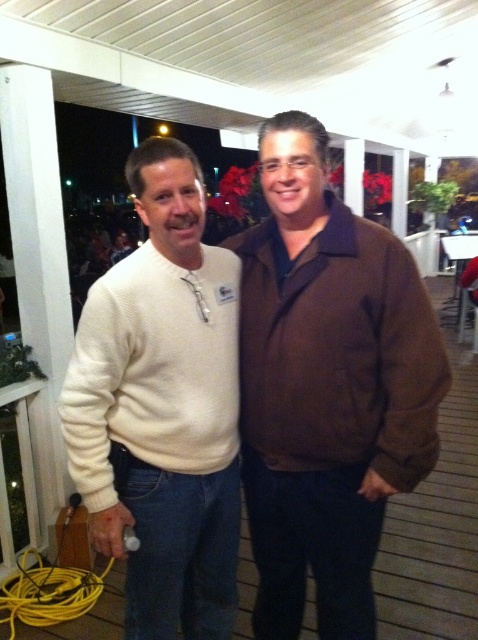
You are a photographer standing at the camera position. You want to take a closeup shot of the brown corduroy jacket at center without moving the camera. Is it possible to zoom in enough to capture the jacket clearly?

The brown corduroy jacket at center is 1.36 meters away from the camera. Assuming a standard zoom lens can focus at that distance, yes, you can zoom in to capture the jacket clearly without moving the camera.

You are trying to describe the clothing of the two men in the image. Which man is wearing the brown corduroy jacket at center and which is wearing the white sweater at left?

The man on the right is wearing the brown corduroy jacket at center, and the man on the left is wearing the white sweater at left.